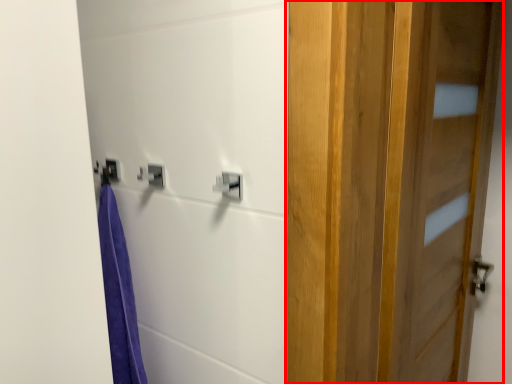
Question: From the image, what is the correct spatial relationship of door (annotated by the red box) in relation to lock?

Choices:
 (A) right
 (B) left

Answer: (A)